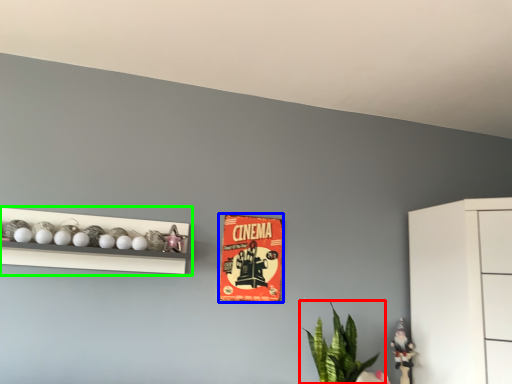
Question: Which is nearer to the houseplant (highlighted by a red box)? postcard (highlighted by a blue box) or shelf (highlighted by a green box).

Choices:
 (A) postcard
 (B) shelf

Answer: (A)